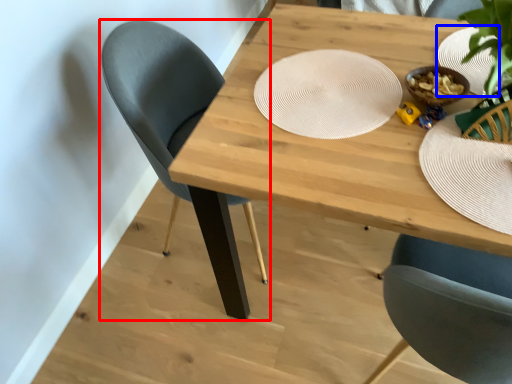
Question: Among these objects, which one is nearest to the camera, chair (highlighted by a red box) or paper plate (highlighted by a blue box)?

Choices:
 (A) chair
 (B) paper plate

Answer: (B)